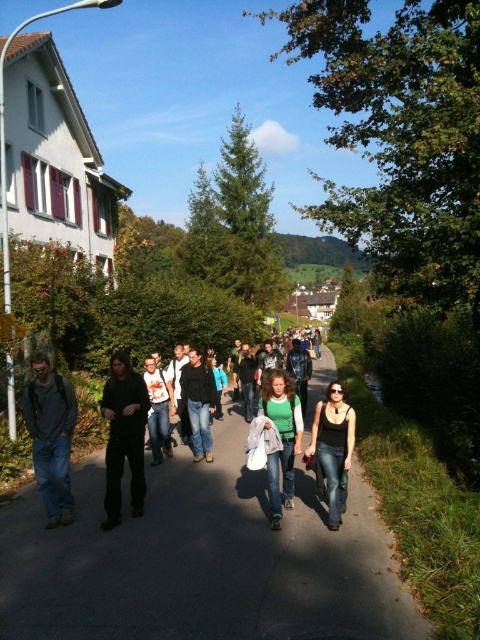
Does matte gray backpack at left have a larger size compared to green matte shirt at center?

Incorrect, matte gray backpack at left is not larger than green matte shirt at center.

Which is above, matte gray backpack at left or green matte shirt at center?

matte gray backpack at left is higher up.

Is point (57, 522) positioned before point (287, 397)?

Yes, it is in front of point (287, 397).

What are the coordinates of `matte gray backpack at left` in the screenshot? It's located at (50, 436).

Between point (337, 524) and point (292, 486), which one is positioned in front?

Point (337, 524)

Between point (309, 445) and point (276, 410), which one is positioned behind?

The point (309, 445) is behind.

Is point (345, 420) positioned in front of point (273, 497)?

No, (345, 420) is behind (273, 497).

The height and width of the screenshot is (640, 480). I want to click on black matte tank top at center, so click(334, 448).

Is dark matte clothing at center above green matte shirt at center?

Yes, dark matte clothing at center is above green matte shirt at center.

Can you confirm if dark matte clothing at center is positioned below green matte shirt at center?

Incorrect, dark matte clothing at center is not positioned below green matte shirt at center.

You are a GUI agent. You are given a task and a screenshot of the screen. Output one action in this format:
    pyautogui.click(x=<x>, y=<y>)
    Task: Click on the dark matte clothing at center
    The width and height of the screenshot is (480, 640).
    Given the screenshot: What is the action you would take?
    pyautogui.click(x=123, y=436)